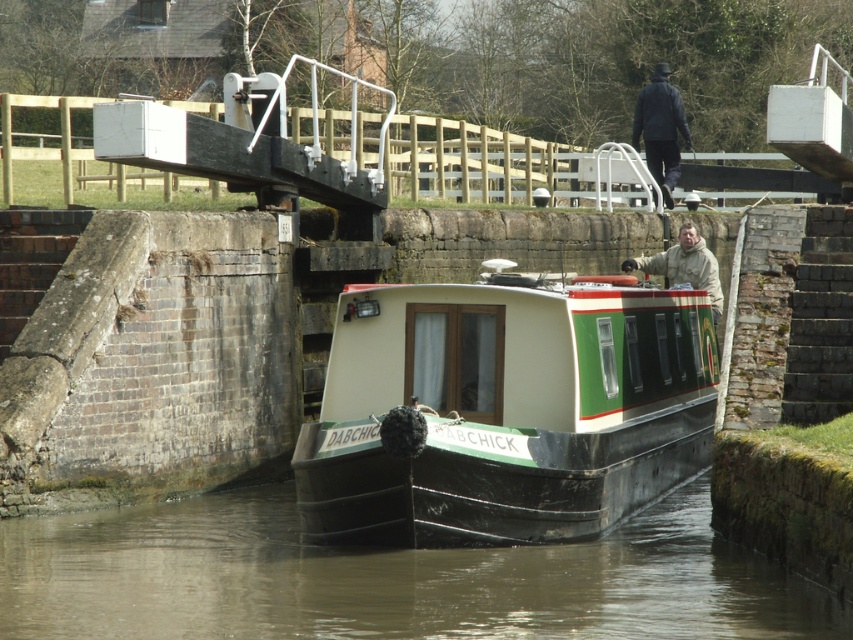
You are a boat operator on the DABCHICK narrowboat and need to navigate through the canal lock. The lock has a specific entry point for the boat. Where should you aim to position the boat relative to the brown murky water at center?

You should aim to position the boat at the coordinates where the brown murky water at center is located, which is at point (389, 579), as this indicates the entry point for the canal lock.

You are a photographer planning to take a photo of the green matte houseboat at center and the dark blue jacket at upper center. Based on their heights, which object should be placed closer to the camera to ensure both appear equally tall in the photo?

The green matte houseboat at center has a lesser height compared to the dark blue jacket at upper center. To make them appear equally tall in the photo, the green matte houseboat at center should be placed closer to the camera than the dark blue jacket at upper center.

Consider the image. You are standing on the bank of the canal and see the green matte houseboat at center and the dark blue jacket at upper center. Which object is closer to the left side of the canal?

The green matte houseboat at center is positioned on the left side of dark blue jacket at upper center, so it is closer to the left side of the canal.